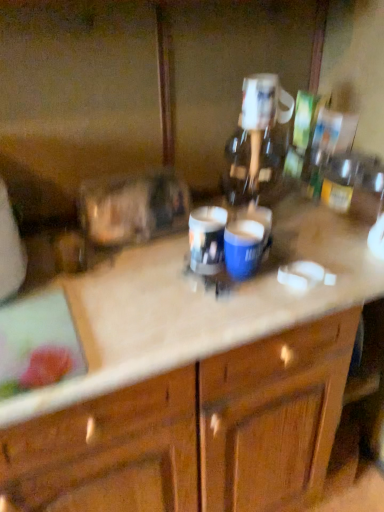
Question: Considering the positions of point (9, 355) and point (200, 257), is point (9, 355) closer or farther from the camera than point (200, 257)?

Choices:
 (A) closer
 (B) farther

Answer: (A)

Question: Is beige marble countertop at center bigger or smaller than matte plastic cup at center, arranged as the second beverage when viewed from the right?

Choices:
 (A) big
 (B) small

Answer: (A)

Question: Which of these objects is positioned closest to the blue glossy mug at center, which is the first beverage in right-to-left order?

Choices:
 (A) beige marble countertop at center
 (B) matte plastic cup at center, arranged as the second beverage when viewed from the right

Answer: (B)

Question: Which object is the farthest from the matte plastic cup at center, which is counted as the 1th beverage, starting from the left?

Choices:
 (A) beige marble countertop at center
 (B) blue glossy mug at center, the 2th beverage from the left

Answer: (A)